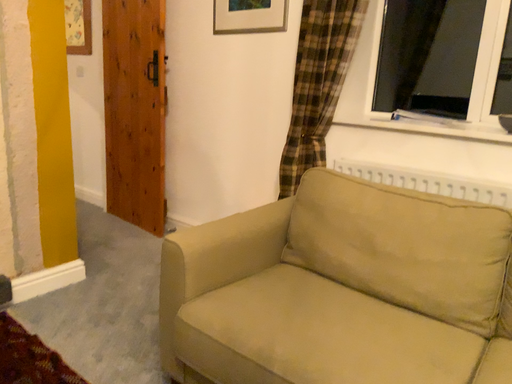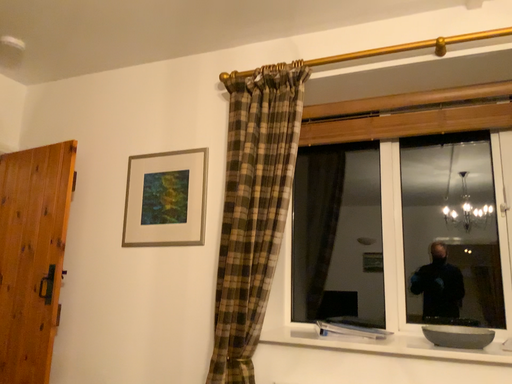
Question: How did the camera likely rotate when shooting the video?

Choices:
 (A) rotated downward
 (B) rotated upward

Answer: (B)